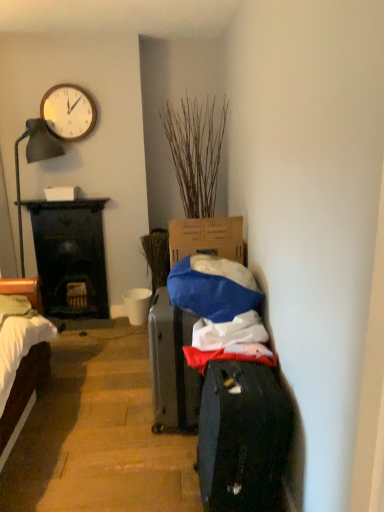
Question: Considering the relative positions of wooden clock at upper left and dark wood desk at left in the image provided, is wooden clock at upper left to the left or to the right of dark wood desk at left?

Choices:
 (A) right
 (B) left

Answer: (A)

Question: From a real-world perspective, is wooden clock at upper left positioned above or below dark wood desk at left?

Choices:
 (A) above
 (B) below

Answer: (A)

Question: Considering the real-world distances, which object is farthest from the dark gray fabric suitcase at center?

Choices:
 (A) dry grass at center
 (B) wooden clock at upper left
 (C) white matte bucket at center
 (D) dark wood desk at left

Answer: (B)

Question: Which object is the farthest from the dark wood desk at left?

Choices:
 (A) white matte bucket at center
 (B) wooden clock at upper left
 (C) dry grass at center
 (D) dark gray fabric suitcase at center

Answer: (D)